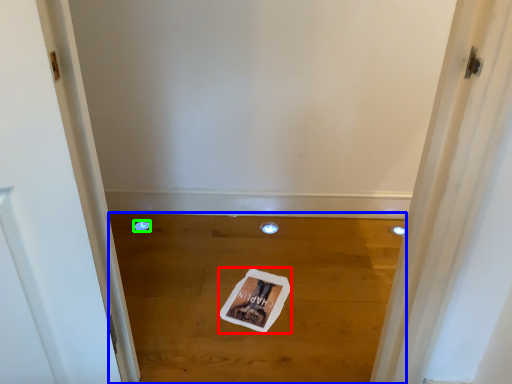
Question: Considering the real-world distances, which object is farthest from magazine (highlighted by a red box)? plain (highlighted by a blue box) or hole (highlighted by a green box)?

Choices:
 (A) plain
 (B) hole

Answer: (B)